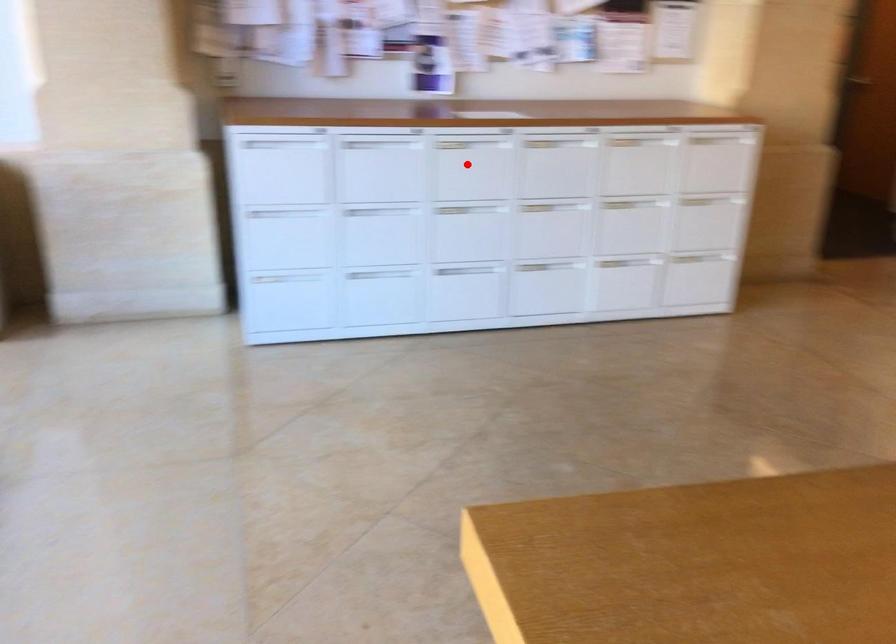
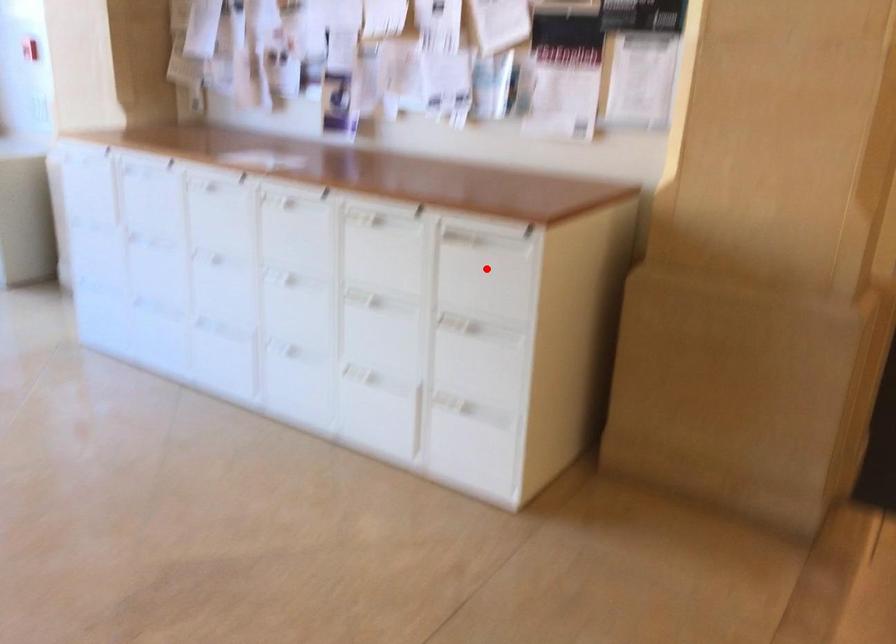
I am providing you with two images of the same scene from different viewpoints. A red point is marked on the first image and another point is marked on the second image. Is the marked point in image1 the same physical position as the marked point in image2?

No